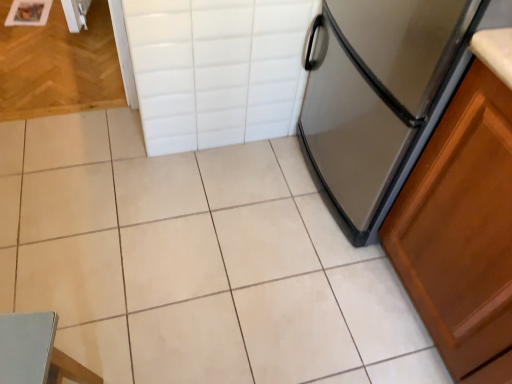
Where is `free location to the left of satin silver refrigerator at right`? This screenshot has height=384, width=512. free location to the left of satin silver refrigerator at right is located at coordinates (244, 198).